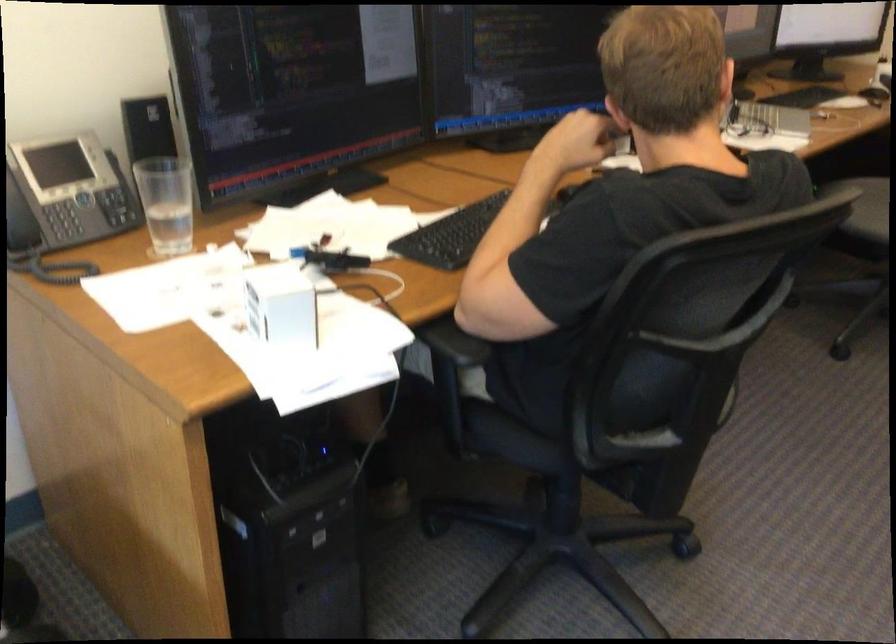
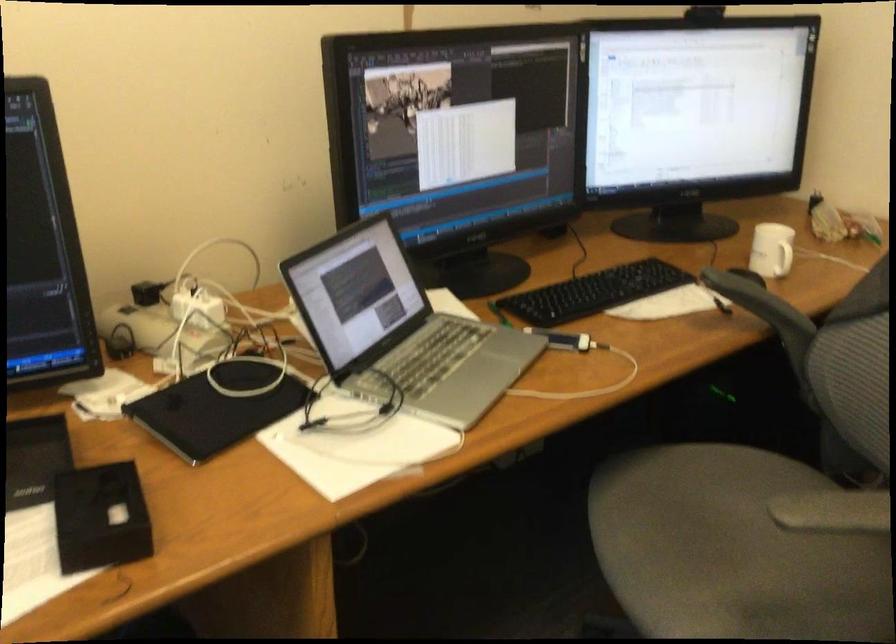
In a continuous first-person perspective shot, in which direction is the camera moving?

The movement direction of the cameraman is right, forward.